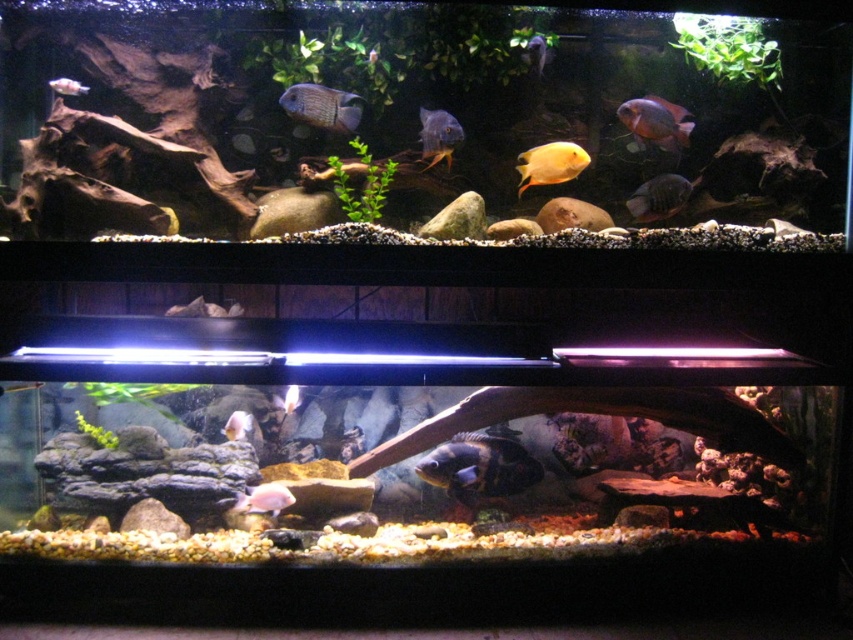
You are an aquatic enthusiast observing the aquarium. You notice the shiny blue fish at center and the white matte fish at lower center. Which fish has a larger height?

The shiny blue fish at center has a greater height compared to the white matte fish at lower center.

You are a new fish in the aquarium and want to swim from the point at coordinates point (515, 442) to the point at coordinates point (286, 400). Based on the aquarium layout, will you be swimming towards the front or the back of the aquarium?

Point (515, 442) is in front of point (286, 400), so swimming from point (515, 442) to point (286, 400) means you are moving towards the back of the aquarium.

You are a marine biologist observing the aquarium. You notice a point marked at coordinates (479,467). Which object in the aquarium does this point correspond to?

The point at coordinates (479,467) is located on the shiny blue fish at center.